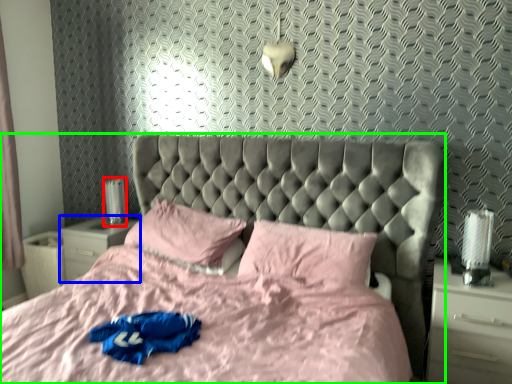
Question: Estimate the real-world distances between objects in this image. Which object is closer to table lamp (highlighted by a red box), nightstand (highlighted by a blue box) or bed (highlighted by a green box)?

Choices:
 (A) nightstand
 (B) bed

Answer: (A)